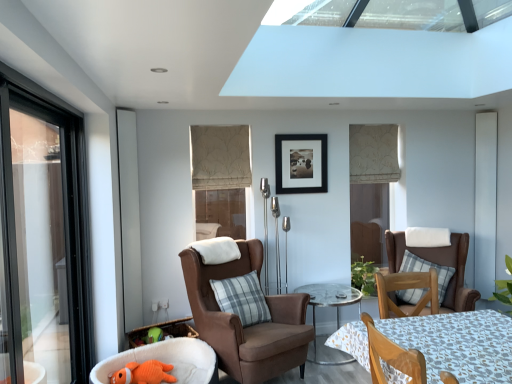
This screenshot has width=512, height=384. What do you see at coordinates (221, 177) in the screenshot? I see `beige textured roman shade at center, the first window viewed from the front` at bounding box center [221, 177].

Locate an element on the screen. The width and height of the screenshot is (512, 384). beige textured roman shade at center, the first window viewed from the front is located at coordinates point(221,177).

Measure the distance between suede brown armchair at center, which is the third chair from right to left, and camera.

suede brown armchair at center, which is the third chair from right to left, is 2.88 meters away from camera.

Find the location of a particular element. suede brown armchair at center, arranged as the second chair when viewed from the left is located at coordinates (247, 326).

This screenshot has width=512, height=384. What do you see at coordinates (166, 361) in the screenshot?
I see `orange plush toy at lower left, positioned as the first chair in left-to-right order` at bounding box center [166, 361].

Identify the location of clear glass table at center. This screenshot has height=384, width=512. (330, 306).

What do you see at coordinates (242, 298) in the screenshot? I see `gray plaid pillow at center, arranged as the 1th pillow when viewed from the left` at bounding box center [242, 298].

Find the location of a particular element. wooden chair at lower right, the third chair viewed from the left is located at coordinates click(392, 356).

Identify the location of beige textured roman shade at center, the second window viewed from the back. This screenshot has height=384, width=512. (221, 177).

Considering the positions of point (190, 300) and point (423, 259), is point (190, 300) closer or farther from the camera than point (423, 259)?

Point (190, 300) is positioned closer to the camera compared to point (423, 259).

Considering the positions of objects suede brown armchair at center, which is the third chair from right to left, and plaid fabric pillow at center, acting as the first pillow starting from the back, in the image provided, who is in front, suede brown armchair at center, which is the third chair from right to left, or plaid fabric pillow at center, acting as the first pillow starting from the back,?

suede brown armchair at center, which is the third chair from right to left, is closer to the camera.

From the image's perspective, is suede brown armchair at center, arranged as the second chair when viewed from the left, located above or below plaid fabric pillow at center, the 2th pillow when ordered from left to right?

From the image's perspective, suede brown armchair at center, arranged as the second chair when viewed from the left, appears below plaid fabric pillow at center, the 2th pillow when ordered from left to right.

Is suede brown armchair at center, which is the third chair from right to left, positioned beyond the bounds of plaid fabric pillow at center, which is the first pillow in right-to-left order?

Yes, suede brown armchair at center, which is the third chair from right to left, is not within plaid fabric pillow at center, which is the first pillow in right-to-left order.

Between beige textured roman shade at center, the second window viewed from the back, and matte beige blind at center, acting as the second window starting from the front, which one is positioned in front?

beige textured roman shade at center, the second window viewed from the back, is more forward.

From a real-world perspective, between beige textured roman shade at center, which is the first window from top to bottom, and matte beige blind at center, which is counted as the first window, starting from the bottom, who is vertically higher?

beige textured roman shade at center, which is the first window from top to bottom, from a real-world perspective.

In the scene shown: Is beige textured roman shade at center, positioned as the 2th window in bottom-to-top order, far from matte beige blind at center, which is counted as the first window, starting from the bottom?

No, beige textured roman shade at center, positioned as the 2th window in bottom-to-top order, is not far away from matte beige blind at center, which is counted as the first window, starting from the bottom.

Which is nearer, (197, 173) or (238, 198)?

The point (197, 173) is more forward.

Between orange plush toy at lower left, positioned as the first chair in left-to-right order, and plaid fabric pillow at center, positioned as the 2th pillow in front-to-back order, which one appears on the left side from the viewer's perspective?

orange plush toy at lower left, positioned as the first chair in left-to-right order.

Is orange plush toy at lower left, positioned as the first chair in left-to-right order, oriented away from plaid fabric pillow at center, which is the first pillow in right-to-left order?

No, orange plush toy at lower left, positioned as the first chair in left-to-right order,'s orientation is not away from plaid fabric pillow at center, which is the first pillow in right-to-left order.

From a real-world perspective, which is physically above, orange plush toy at lower left, arranged as the fourth chair when viewed from the right, or plaid fabric pillow at center, acting as the first pillow starting from the back?

In real-world perspective, plaid fabric pillow at center, acting as the first pillow starting from the back, is above.

From their relative heights in the image, would you say orange plush toy at lower left, arranged as the fourth chair when viewed from the right, is taller or shorter than plaid fabric pillow at center, acting as the first pillow starting from the back?

Clearly, orange plush toy at lower left, arranged as the fourth chair when viewed from the right, is shorter compared to plaid fabric pillow at center, acting as the first pillow starting from the back.

From a real-world perspective, is brown leather chair at right, which is counted as the 1th chair, starting from the right, on top of white glossy screen door at left, which is the first screen door from front to back?

No, from a real-world perspective, brown leather chair at right, which is counted as the 1th chair, starting from the right, is not over white glossy screen door at left, which is the first screen door from front to back

Is point (451, 259) positioned after point (136, 206)?

Yes, it is behind point (136, 206).

Is brown leather chair at right, acting as the fourth chair starting from the left, spatially inside white glossy screen door at left, which is the first screen door from front to back, or outside of it?

brown leather chair at right, acting as the fourth chair starting from the left, is not inside white glossy screen door at left, which is the first screen door from front to back, it's outside.

Is brown leather chair at right, acting as the fourth chair starting from the left, to the left of white glossy screen door at left, the first screen door positioned from the left, from the viewer's perspective?

No, brown leather chair at right, acting as the fourth chair starting from the left, is not to the left of white glossy screen door at left, the first screen door positioned from the left.

At what (x,y) coordinates should I click in order to perform the action: click on chair that is the 2nd one when counting leftward from the plaid fabric pillow at center, the 2th pillow when ordered from left to right. Please return your answer as a coordinate pair (x, y). This screenshot has height=384, width=512. Looking at the image, I should click on (392, 356).

From the picture: From a real-world perspective, is plaid fabric pillow at center, positioned as the 2th pillow in front-to-back order, positioned above or below wooden chair at lower right, which is the second chair from right to left?

Clearly, from a real-world perspective, plaid fabric pillow at center, positioned as the 2th pillow in front-to-back order, is below wooden chair at lower right, which is the second chair from right to left.

Considering the sizes of objects plaid fabric pillow at center, the 2th pillow when ordered from left to right, and wooden chair at lower right, which is the second chair from right to left, in the image provided, who is wider, plaid fabric pillow at center, the 2th pillow when ordered from left to right, or wooden chair at lower right, which is the second chair from right to left,?

Wider between the two is wooden chair at lower right, which is the second chair from right to left.

Can you confirm if plaid fabric pillow at center, acting as the first pillow starting from the back, is positioned to the left of wooden chair at lower right, which is the second chair from right to left?

No, plaid fabric pillow at center, acting as the first pillow starting from the back, is not to the left of wooden chair at lower right, which is the second chair from right to left.

From the image's perspective, is orange plush toy at lower left, arranged as the fourth chair when viewed from the right, on clear glass table at center?

No, from the image's perspective, orange plush toy at lower left, arranged as the fourth chair when viewed from the right, is not on top of clear glass table at center.

Between orange plush toy at lower left, arranged as the fourth chair when viewed from the right, and clear glass table at center, which one has smaller width?

Thinner between the two is clear glass table at center.

Is orange plush toy at lower left, positioned as the first chair in left-to-right order, oriented away from clear glass table at center?

No, orange plush toy at lower left, positioned as the first chair in left-to-right order, is not facing away from clear glass table at center.

From their relative heights in the image, would you say orange plush toy at lower left, positioned as the first chair in left-to-right order, is taller or shorter than clear glass table at center?

orange plush toy at lower left, positioned as the first chair in left-to-right order, is shorter than clear glass table at center.

Does plaid fabric pillow at center, positioned as the 2th pillow in front-to-back order, contain beige textured roman shade at center, the second window viewed from the back?

No, beige textured roman shade at center, the second window viewed from the back, is not surrounded by plaid fabric pillow at center, positioned as the 2th pillow in front-to-back order.

From the image's perspective, is plaid fabric pillow at center, which is the first pillow in right-to-left order, located beneath beige textured roman shade at center, positioned as the 2th window in bottom-to-top order?

Indeed, from the image's perspective, plaid fabric pillow at center, which is the first pillow in right-to-left order, is shown beneath beige textured roman shade at center, positioned as the 2th window in bottom-to-top order.

From a real-world perspective, who is located lower, plaid fabric pillow at center, positioned as the 2th pillow in front-to-back order, or beige textured roman shade at center, the second window viewed from the back?

plaid fabric pillow at center, positioned as the 2th pillow in front-to-back order.

From the plaid fabric pillow at center, which is the first pillow in right-to-left order, count the 3rd chair to the left and point to it. Please provide its 2D coordinates.

[(247, 326)]

Find the location of `window beneath the beige textured roman shade at center, the second window viewed from the back (from a real-world perspective)`. window beneath the beige textured roman shade at center, the second window viewed from the back (from a real-world perspective) is located at coordinates (223, 211).

Based on their spatial positions, is beige fabric curtain at upper center or plaid fabric pillow at center, the 2th pillow when ordered from left to right, further from white matte screen door at right, positioned as the first screen door in back-to-front order?

beige fabric curtain at upper center is positioned further to the anchor white matte screen door at right, positioned as the first screen door in back-to-front order.

Which object lies further to the anchor point black matte picture frame at center, gray plaid pillow at center, arranged as the 1th pillow when viewed from the left, or white matte screen door at right, positioned as the first screen door in back-to-front order?

Based on the image, white matte screen door at right, positioned as the first screen door in back-to-front order, appears to be further to black matte picture frame at center.

Which object lies nearer to the anchor point matte beige blind at center, the first window positioned from the back, wooden chair at lower right, which is the second chair from right to left, or beige fabric curtain at upper center?

The object closer to matte beige blind at center, the first window positioned from the back, is beige fabric curtain at upper center.

Based on their spatial positions, is black matte picture frame at center or white glossy screen door at left, which is the first screen door from front to back, further from green leafy plant at center?

white glossy screen door at left, which is the first screen door from front to back, lies further to green leafy plant at center than the other object.

When comparing their distances from orange plush toy at lower left, does brown leather chair at right, which is counted as the 1th chair, starting from the right, or suede brown armchair at center, arranged as the second chair when viewed from the left, seem closer?

suede brown armchair at center, arranged as the second chair when viewed from the left, is closer to orange plush toy at lower left.

Estimate the real-world distances between objects in this image. Which object is further from gray plaid pillow at center, marked as the second pillow in a right-to-left arrangement, brown leather chair at right, which is counted as the 1th chair, starting from the right, or wooden chair at lower right, the third chair viewed from the left?

Based on the image, brown leather chair at right, which is counted as the 1th chair, starting from the right, appears to be further to gray plaid pillow at center, marked as the second pillow in a right-to-left arrangement.

Which object lies further to the anchor point black matte picture frame at center, suede brown armchair at center, which is the third chair from right to left, or white glossy screen door at left, the first screen door positioned from the left?

The object further to black matte picture frame at center is white glossy screen door at left, the first screen door positioned from the left.

Consider the image. When comparing their distances from clear glass table at center, does orange plush toy at lower left or plaid fabric pillow at center, the 2th pillow when ordered from left to right, seem further?

orange plush toy at lower left lies further to clear glass table at center than the other object.

What are the coordinates of `picture frame between wooden chair at lower right, the third chair viewed from the left, and white matte screen door at right, positioned as the first screen door in back-to-front order, along the z-axis` in the screenshot? It's located at (301, 163).

Where is `curtain between orange plush toy at lower left and brown leather chair at right, which is counted as the 1th chair, starting from the right, from left to right`? The height and width of the screenshot is (384, 512). curtain between orange plush toy at lower left and brown leather chair at right, which is counted as the 1th chair, starting from the right, from left to right is located at coordinates (373, 153).

You are a GUI agent. You are given a task and a screenshot of the screen. Output one action in this format:
    pyautogui.click(x=<x>, y=<y>)
    Task: Click on the plant between orange plush toy at lower left, arranged as the fourth chair when viewed from the right, and brown leather chair at right, acting as the fourth chair starting from the left, from left to right
    This screenshot has width=512, height=384.
    Given the screenshot: What is the action you would take?
    pyautogui.click(x=364, y=276)

Find the location of a particular element. The height and width of the screenshot is (384, 512). pillow located between orange plush toy at lower left and green leafy plant at center in the left-right direction is located at coordinates (242, 298).